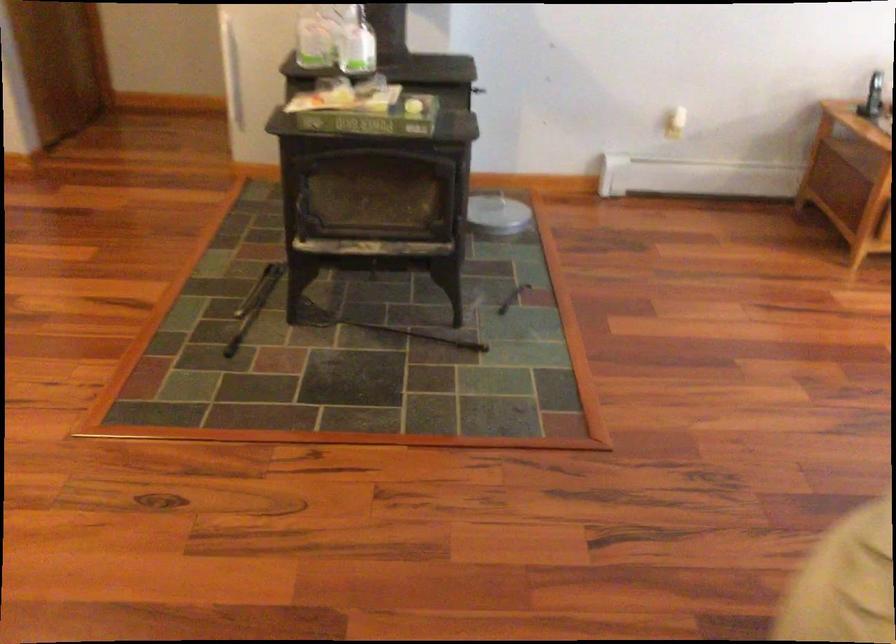
At what (x,y) coordinates should I click in order to perform the action: click on black metal tool. Please return your answer as a coordinate pair (x, y). Looking at the image, I should click on (254, 305).